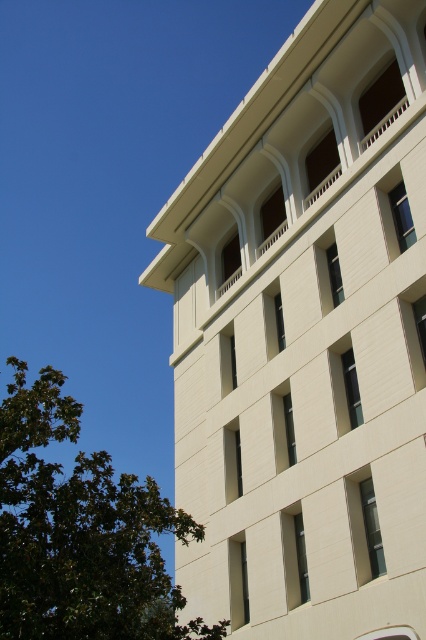
Who is positioned more to the left, white smooth building at upper center or green leafy tree at lower left?

green leafy tree at lower left is more to the left.

Identify the location of white smooth building at upper center. (307, 336).

Does point (304, 134) come closer to viewer compared to point (2, 436)?

No.

Where is `white smooth building at upper center`? The height and width of the screenshot is (640, 426). white smooth building at upper center is located at coordinates (307, 336).